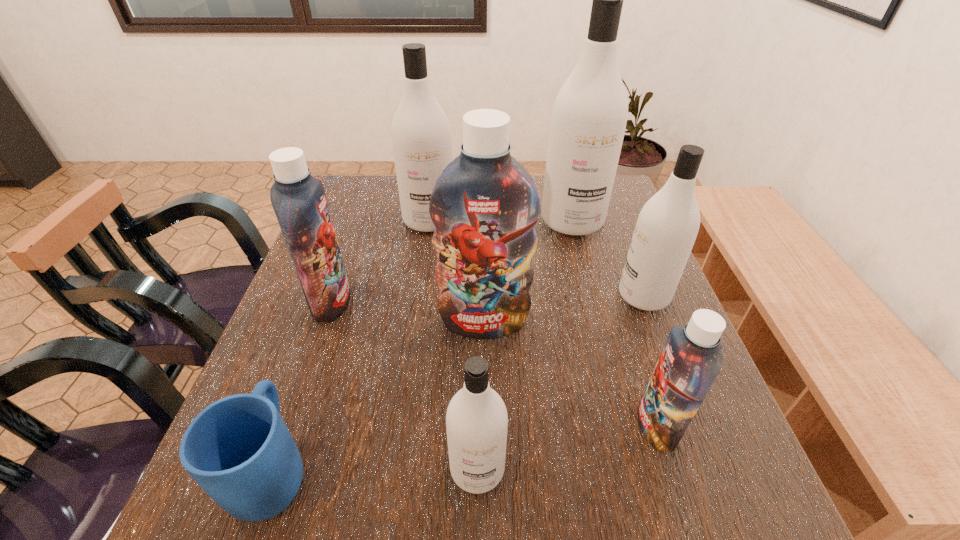
Identify the location of free location that satisfies the following two spatial constraints: 1. on the side of the shortest object with the handle; 2. on the front label of the leftmost shampoo. This screenshot has width=960, height=540. (332, 301).

Identify the location of free spot that satisfies the following two spatial constraints: 1. on the side of the blue mug with the handle; 2. on the front label of the leftmost blue shampoo. (332, 301).

Locate an element on the screen. Image resolution: width=960 pixels, height=540 pixels. vacant space that satisfies the following two spatial constraints: 1. on the front-facing side of the leftmost white shampoo; 2. on the front label of the leftmost shampoo is located at coordinates (418, 301).

Where is `free spot that satisfies the following two spatial constraints: 1. on the front-facing side of the third biggest white shampoo; 2. on the front-facing side of the second white shampoo from left to right`? The width and height of the screenshot is (960, 540). free spot that satisfies the following two spatial constraints: 1. on the front-facing side of the third biggest white shampoo; 2. on the front-facing side of the second white shampoo from left to right is located at coordinates (711, 469).